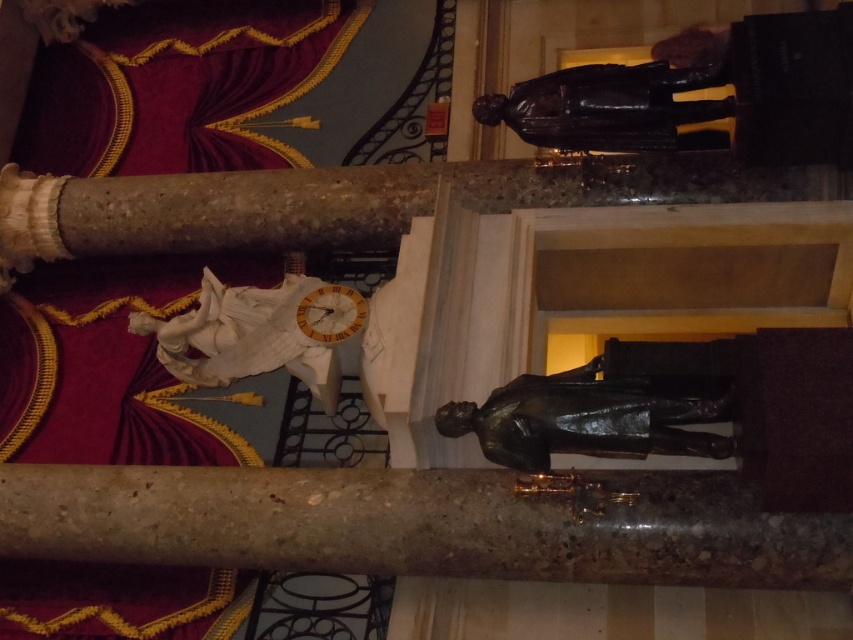
Question: Which point appears farthest from the camera in this image?

Choices:
 (A) (556, 99)
 (B) (186, 328)
 (C) (509, 390)

Answer: (B)

Question: Which point appears farthest from the camera in this image?

Choices:
 (A) (224, 368)
 (B) (628, 102)

Answer: (A)

Question: Is white marble statue at center smaller than bronze statue at upper right?

Choices:
 (A) yes
 (B) no

Answer: (B)

Question: Can you confirm if bronze statue at center is positioned to the left of bronze statue at upper right?

Choices:
 (A) no
 (B) yes

Answer: (B)

Question: Which of these objects is positioned farthest from the bronze statue at center?

Choices:
 (A) bronze statue at upper right
 (B) white marble statue at center

Answer: (A)

Question: Is bronze statue at center further to camera compared to white marble statue at center?

Choices:
 (A) no
 (B) yes

Answer: (A)